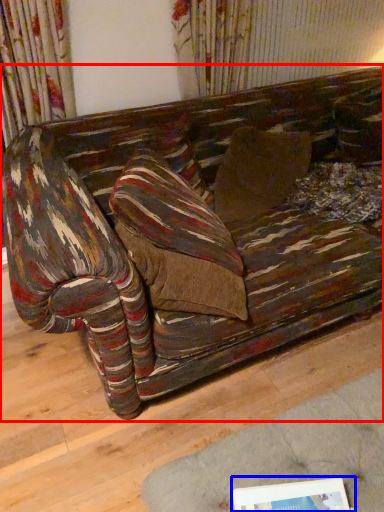
Question: Among these objects, which one is farthest to the camera, studio couch (highlighted by a red box) or picture frame (highlighted by a blue box)?

Choices:
 (A) studio couch
 (B) picture frame

Answer: (A)